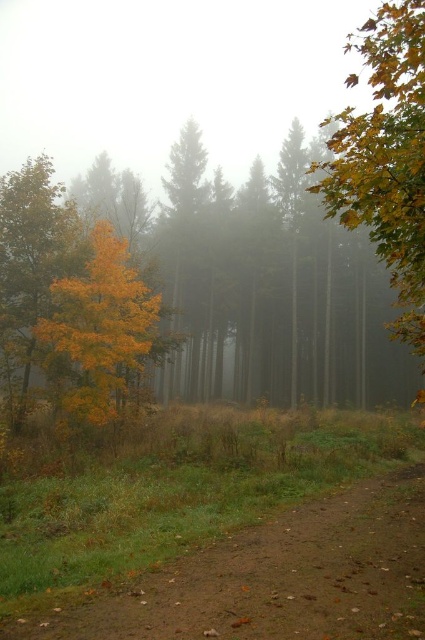
Question: Is brown dirt path at lower right smaller than golden maple leaf at right?

Choices:
 (A) no
 (B) yes

Answer: (B)

Question: Does brown dirt path at lower right have a greater width compared to golden yellow leaves at center?

Choices:
 (A) yes
 (B) no

Answer: (B)

Question: Is brown dirt path at lower right closer to the viewer compared to golden maple leaf at right?

Choices:
 (A) no
 (B) yes

Answer: (B)

Question: Based on their relative distances, which object is nearer to the brown dirt path at lower right?

Choices:
 (A) golden maple leaf at right
 (B) golden yellow leaves at center

Answer: (B)

Question: Which point is farther to the camera?

Choices:
 (A) brown dirt path at lower right
 (B) golden yellow leaves at center

Answer: (B)

Question: Considering the real-world distances, which object is closest to the brown dirt path at lower right?

Choices:
 (A) golden yellow leaves at center
 (B) golden maple leaf at right

Answer: (A)